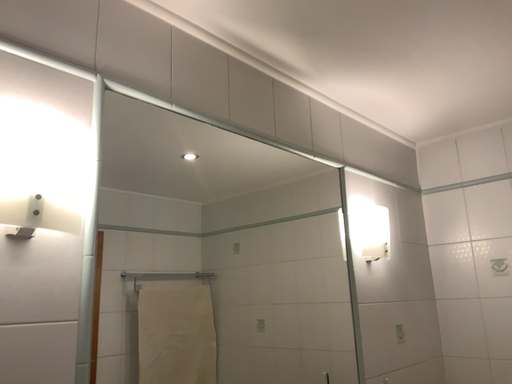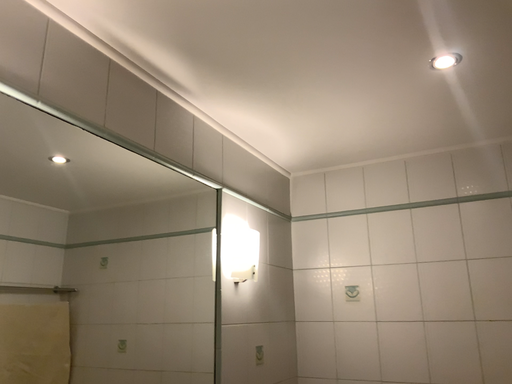
Question: Which way did the camera rotate in the video?

Choices:
 (A) rotated left
 (B) rotated right

Answer: (B)